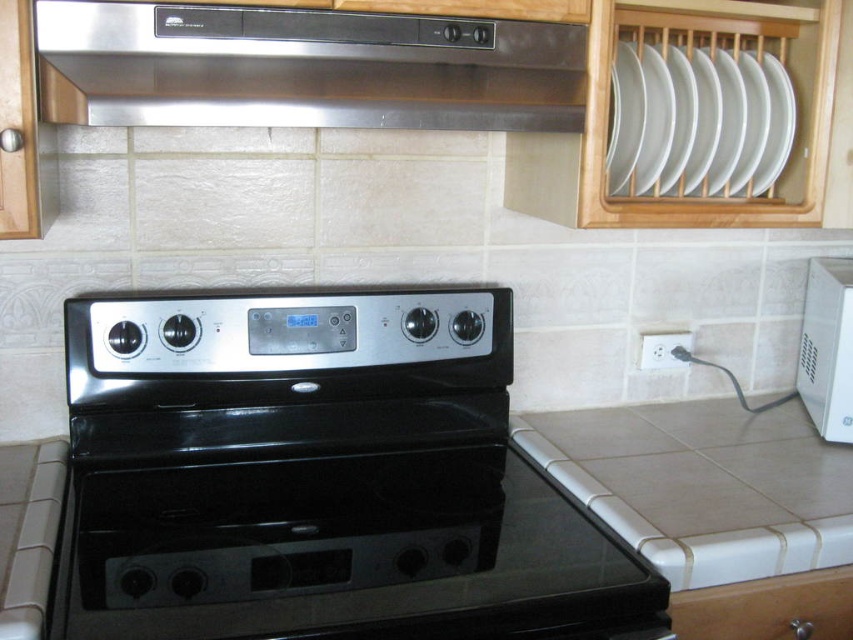
You are a kitchen designer planning to install a new appliance between the stainless steel exhaust hood at upper center and the white glossy microwave at right. Based on their positions, which appliance should be placed on the left side of the new appliance?

The stainless steel exhaust hood at upper center is to the left of the white glossy microwave at right, so the new appliance should be placed between them with the stainless steel exhaust hood at upper center on the left side.

You are a technician trying to install a new sensor on the stainless steel exhaust hood at upper center. The sensor requires a mounting bracket that must be placed exactly at point 0.108 on the horizontal axis and 0.358 on the vertical axis. Can you confirm if the sensor can be installed at the specified coordinates?

The stainless steel exhaust hood at upper center is located at point (305, 68), so yes, the sensor can be installed at the specified coordinates.